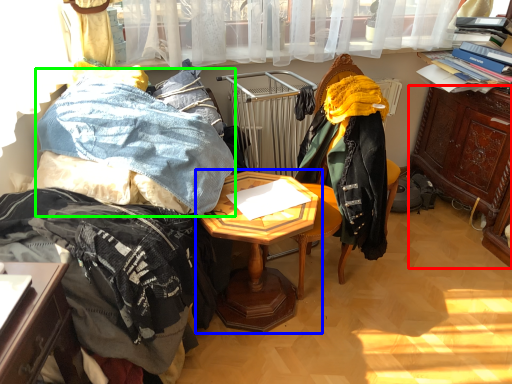
Question: Based on their relative distances, which object is nearer to cabinetry (highlighted by a red box)? Choose from table (highlighted by a blue box) and clothing (highlighted by a green box).

Choices:
 (A) table
 (B) clothing

Answer: (A)